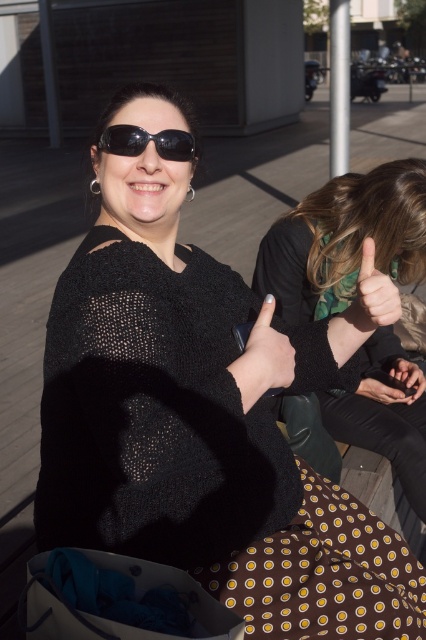
Question: Does matte black hand at lower right lie in front of smooth skin hand at lower right?

Choices:
 (A) no
 (B) yes

Answer: (B)

Question: Is matte black hand at center further to the viewer compared to black reflective sunglasses at center?

Choices:
 (A) yes
 (B) no

Answer: (B)

Question: Based on their relative distances, which object is farther from the matte black hand at upper right?

Choices:
 (A) matte black hand at center
 (B) smooth skin hand at lower right
 (C) matte black hand at lower right
 (D) black knit sweater at upper right

Answer: (C)

Question: Which of the following is the closest to the observer?

Choices:
 (A) black knit sweater at upper right
 (B) matte black hand at upper right
 (C) smooth skin hand at lower right

Answer: (B)

Question: Which of the following is the farthest from the observer?

Choices:
 (A) black reflective sunglasses at center
 (B) matte black hand at center
 (C) black knit sweater at upper right

Answer: (C)

Question: Does matte black hand at upper right have a smaller size compared to matte black hand at lower right?

Choices:
 (A) yes
 (B) no

Answer: (B)